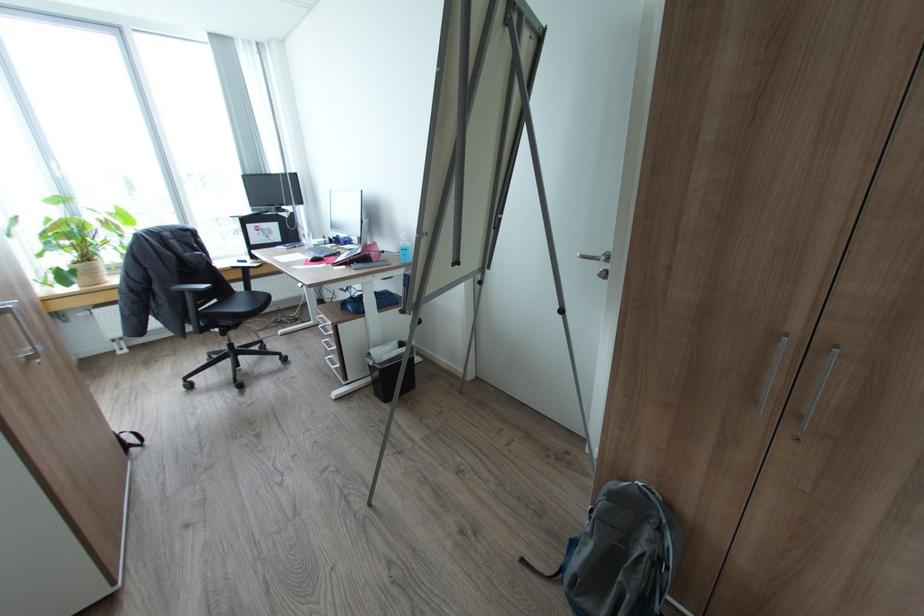
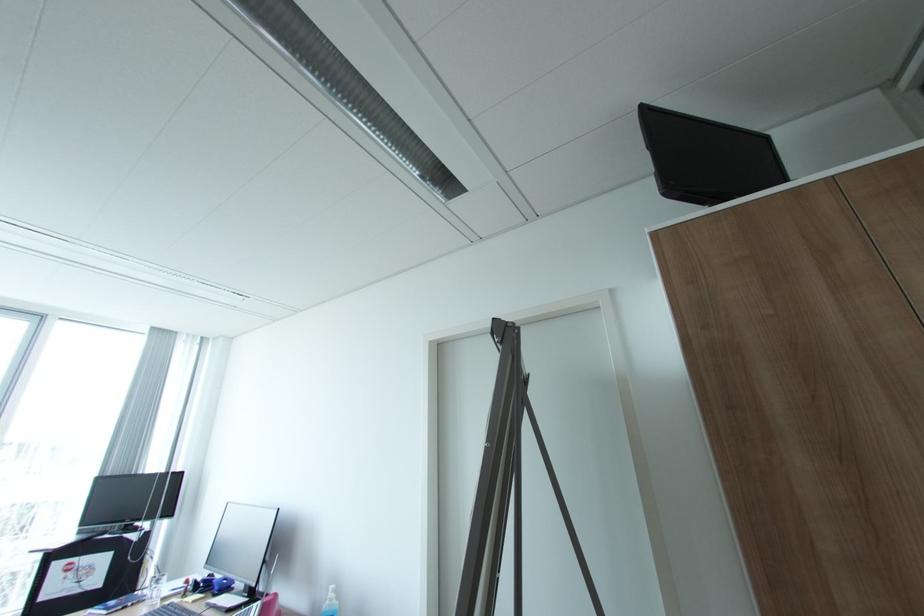
Find the pixel in the second image that matches the point at 347,241 in the first image.

(222, 588)